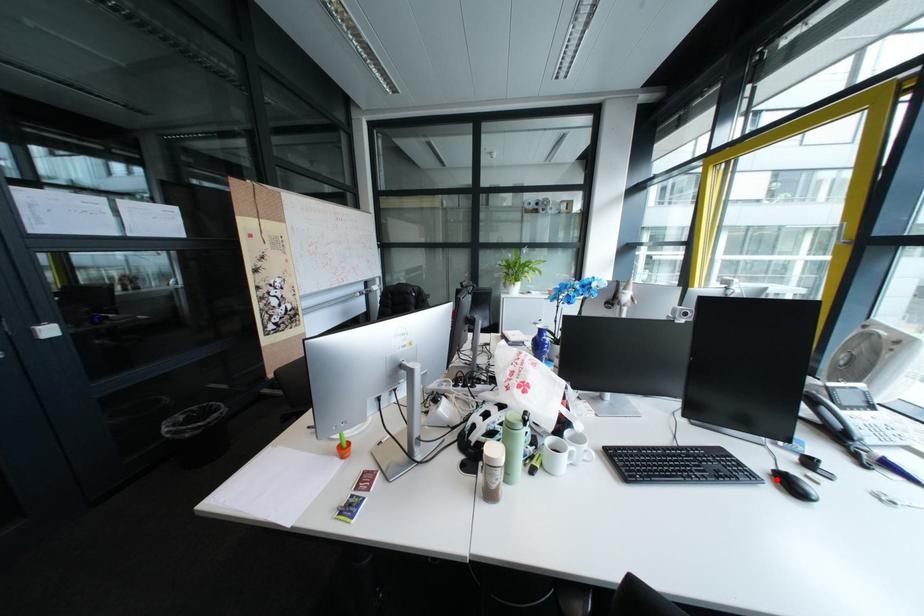
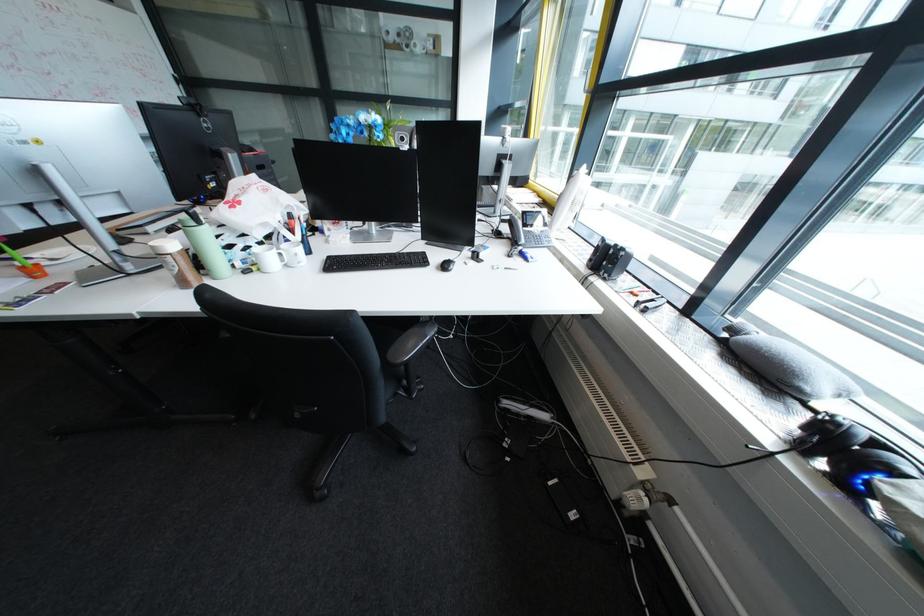
Find the pixel in the second image that matches the highlighted location in the first image.

(444, 264)